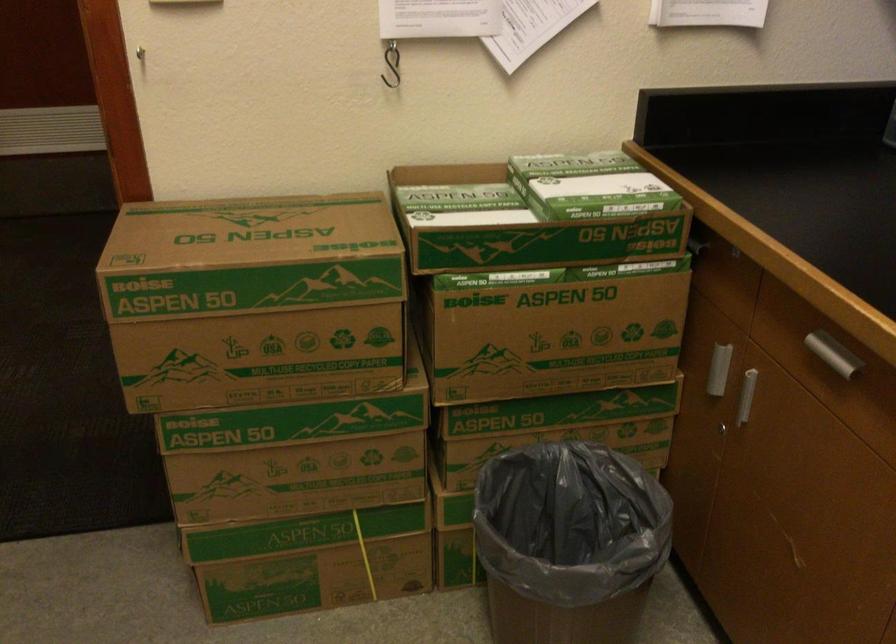
Describe the element at coordinates (727, 433) in the screenshot. I see `a cabinet keyhole` at that location.